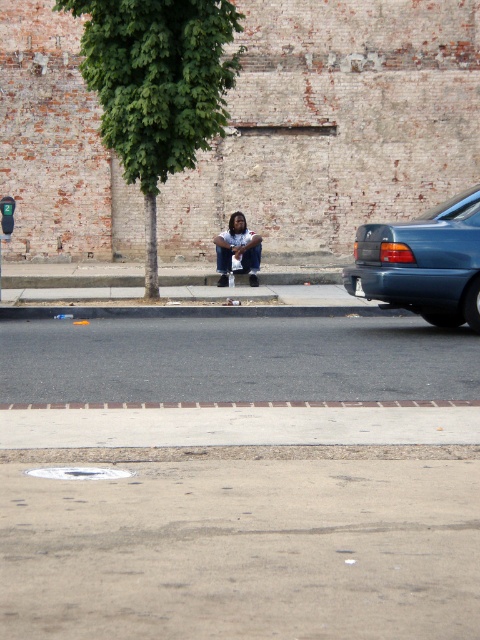
You are a delivery person who needs to park your bike on the street. The bike requires a surface that is both flat and wide enough to prevent tipping. Based on the scene, which area would be more suitable for parking the bike between the smooth concrete pavement at lower center and the gray asphalt at center?

The smooth concrete pavement at lower center is more suitable because it is wider than the gray asphalt at center, providing a stable and flat surface for parking the bike without tipping.

You are a delivery person who needs to park your teal glossy sedan at right on the gray asphalt at center. Is there enough space to park the car there?

The gray asphalt at center is to the left of the teal glossy sedan at right, so there is space available to park the teal glossy sedan at right on the gray asphalt at center.

You are a pedestrian standing on the sidewalk and see the dark blue jeans at center and the teal glossy sedan at right. Which object is positioned farther to the east?

The teal glossy sedan at right is to the right of dark blue jeans at center, so it is positioned farther to the east.